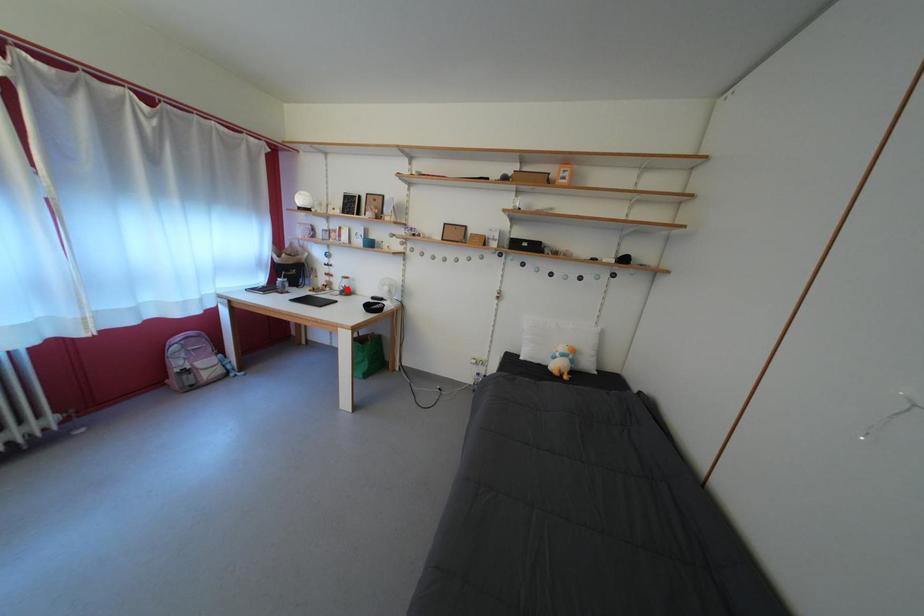
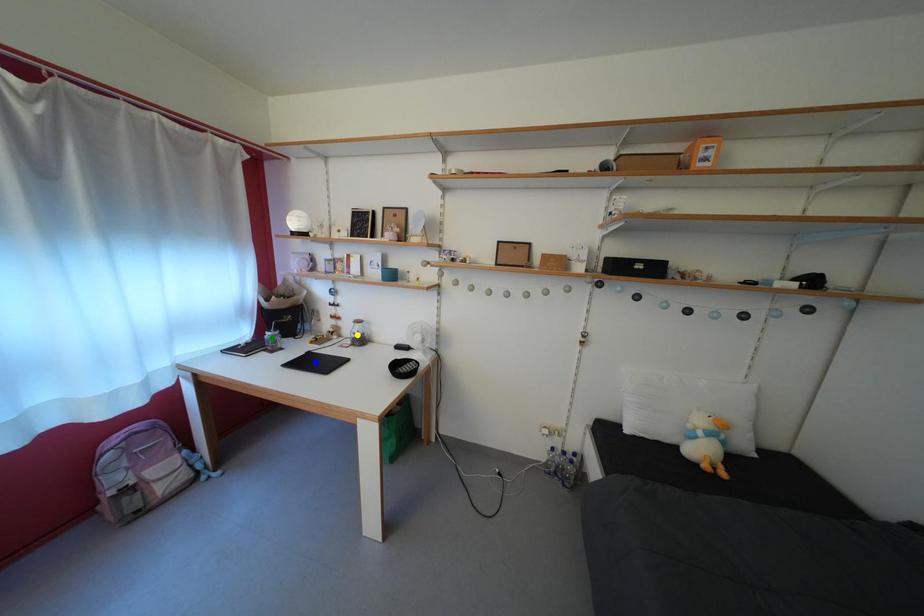
Question: I am providing you with two images of the same scene from different viewpoints. A red point is marked on the first image. You are given multiple points on the second image. Which point in image 2 represents the same 3d spot as the red point in image 1?

Choices:
 (A) blue point
 (B) green point
 (C) yellow point

Answer: (C)